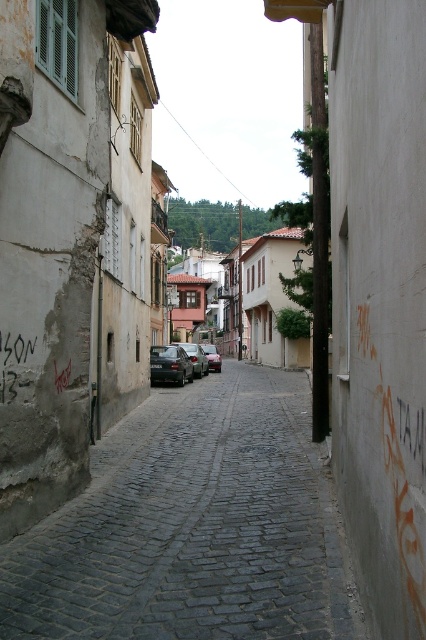
Is dark gray cobblestone alley at center positioned behind metallic gray car at center?

That is False.

Which is in front, point (203, 561) or point (192, 368)?

Point (203, 561)

Find the location of a particular element. This screenshot has height=640, width=426. dark gray cobblestone alley at center is located at coordinates (192, 525).

Which is above, dark gray cobblestone alley at center or shiny black sedan at center?

Positioned higher is shiny black sedan at center.

Between dark gray cobblestone alley at center and shiny black sedan at center, which one appears on the right side from the viewer's perspective?

From the viewer's perspective, dark gray cobblestone alley at center appears more on the right side.

Describe the element at coordinates (192, 525) in the screenshot. I see `dark gray cobblestone alley at center` at that location.

Image resolution: width=426 pixels, height=640 pixels. I want to click on dark gray cobblestone alley at center, so click(x=192, y=525).

Between point (270, 257) and point (195, 349), which one is positioned in front?

Point (195, 349) is more forward.

This screenshot has height=640, width=426. What do you see at coordinates (261, 298) in the screenshot?
I see `brown wooden house at center` at bounding box center [261, 298].

Is point (278, 284) farther from camera compared to point (178, 342)?

No.

Locate an element on the screen. brown wooden house at center is located at coordinates (261, 298).